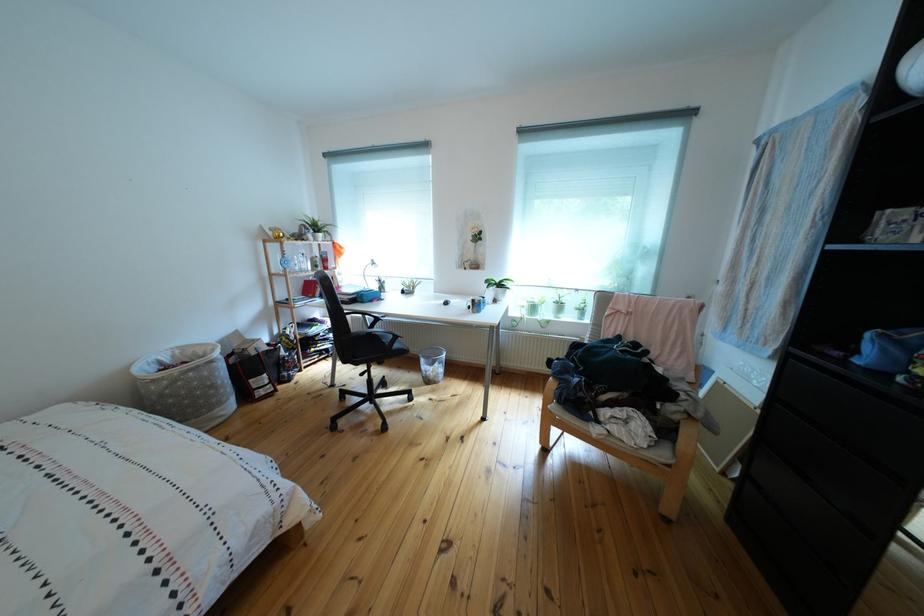
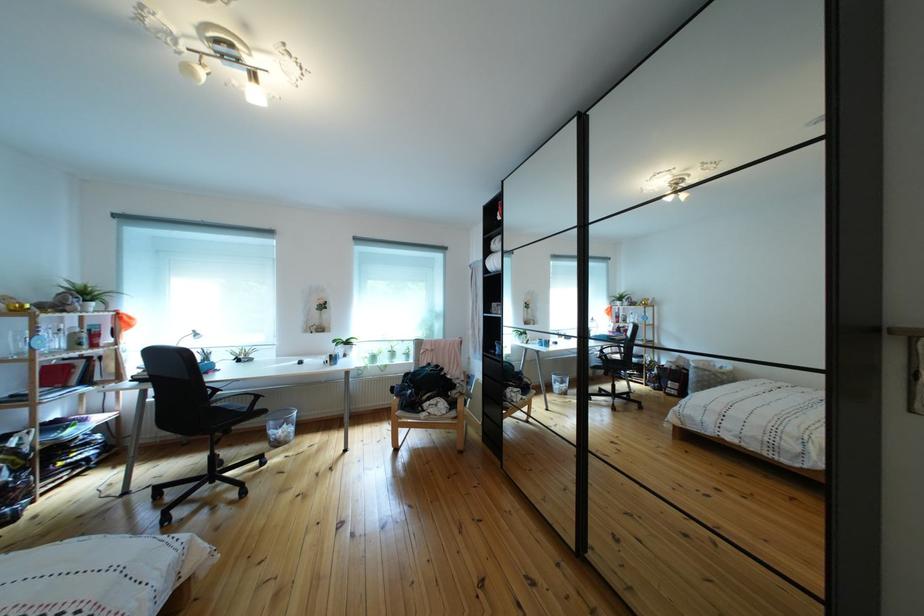
Find the pixel in the second image that matches point 433,367 in the first image.

(283, 430)